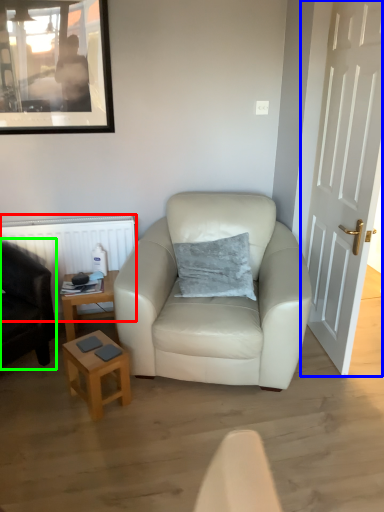
Question: Estimate the real-world distances between objects in this image. Which object is farther from radiator (highlighted by a red box), door (highlighted by a blue box) or chair (highlighted by a green box)?

Choices:
 (A) door
 (B) chair

Answer: (A)